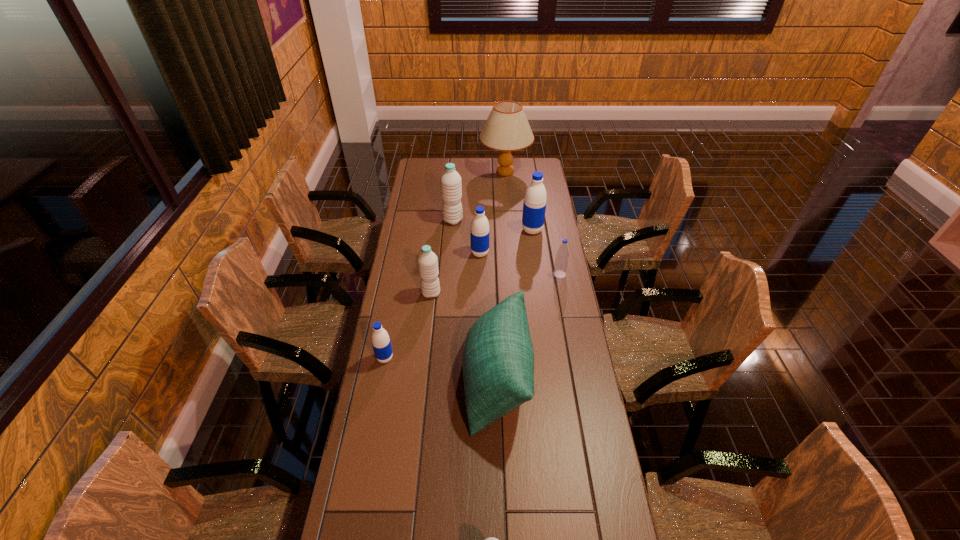
Locate an element on the screen. the fifth nearest object is located at coordinates (561, 262).

The image size is (960, 540). Identify the location of the third farthest blue water bottle. (561, 262).

The width and height of the screenshot is (960, 540). Identify the location of the nearest blue water bottle. (380, 339).

What are the coordinates of `the leftmost object` in the screenshot? It's located at (380, 339).

This screenshot has height=540, width=960. Find the location of `vacant area situated on the left of the lampshade`. vacant area situated on the left of the lampshade is located at coordinates (461, 171).

Locate an element on the screen. vacant position located 0.230m on the front of the farthest white water bottle is located at coordinates (450, 259).

Identify the location of free space located 0.150m on the left of the farthest blue water bottle. This screenshot has height=540, width=960. (490, 230).

The height and width of the screenshot is (540, 960). I want to click on free space located 0.190m on the right of the second biggest white water bottle, so click(x=488, y=293).

Locate an element on the screen. This screenshot has width=960, height=540. vacant space located on the front of the third blue water bottle from right to left is located at coordinates (480, 313).

Locate an element on the screen. This screenshot has height=540, width=960. vacant space situated on the front-facing side of the cushion is located at coordinates (437, 380).